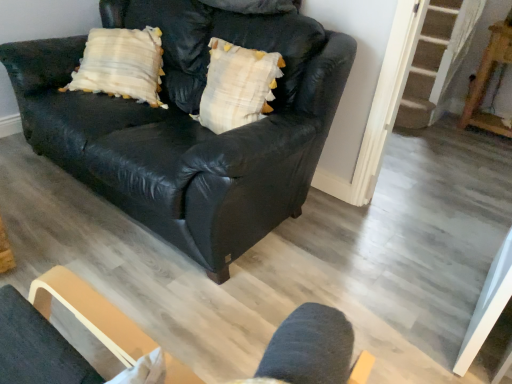
Question: From the image's perspective, is white textured pillow at center located above black leather couch at center?

Choices:
 (A) no
 (B) yes

Answer: (A)

Question: From the image's perspective, is white textured pillow at center located beneath black leather couch at center?

Choices:
 (A) no
 (B) yes

Answer: (B)

Question: Does white textured pillow at center lie in front of black leather couch at center?

Choices:
 (A) no
 (B) yes

Answer: (A)

Question: Considering the relative sizes of white textured pillow at center and black leather couch at center in the image provided, is white textured pillow at center thinner than black leather couch at center?

Choices:
 (A) yes
 (B) no

Answer: (A)

Question: Is white textured pillow at center positioned far away from black leather couch at center?

Choices:
 (A) yes
 (B) no

Answer: (B)

Question: Is point (224, 102) positioned closer to the camera than point (251, 21)?

Choices:
 (A) farther
 (B) closer

Answer: (B)

Question: Would you say white textured pillow at center is to the left or to the right of black leather couch at center in the picture?

Choices:
 (A) left
 (B) right

Answer: (B)

Question: Considering the positions of white textured pillow at center and black leather couch at center in the image, is white textured pillow at center wider or thinner than black leather couch at center?

Choices:
 (A) thin
 (B) wide

Answer: (A)

Question: Is white textured pillow at center taller or shorter than black leather couch at center?

Choices:
 (A) tall
 (B) short

Answer: (B)

Question: Considering the positions of point (501, 41) and point (324, 137), is point (501, 41) closer or farther from the camera than point (324, 137)?

Choices:
 (A) closer
 (B) farther

Answer: (B)

Question: Would you say wooden table at right is inside or outside black leather couch at center?

Choices:
 (A) inside
 (B) outside

Answer: (B)

Question: Relative to black leather couch at center, is wooden table at right in front or behind?

Choices:
 (A) behind
 (B) front

Answer: (A)

Question: From a real-world perspective, is wooden table at right physically located above or below black leather couch at center?

Choices:
 (A) above
 (B) below

Answer: (B)

Question: Is white textured pillow at center spatially inside wooden table at right, or outside of it?

Choices:
 (A) outside
 (B) inside

Answer: (A)

Question: Relative to wooden table at right, is white textured pillow at center in front or behind?

Choices:
 (A) behind
 (B) front

Answer: (B)